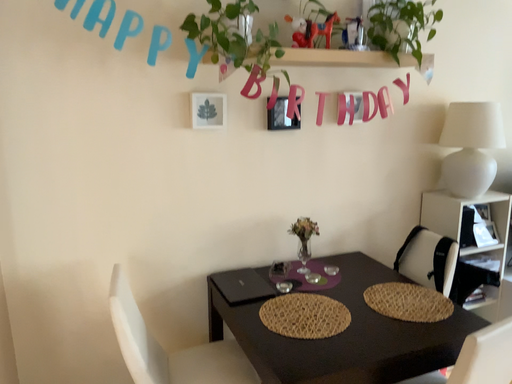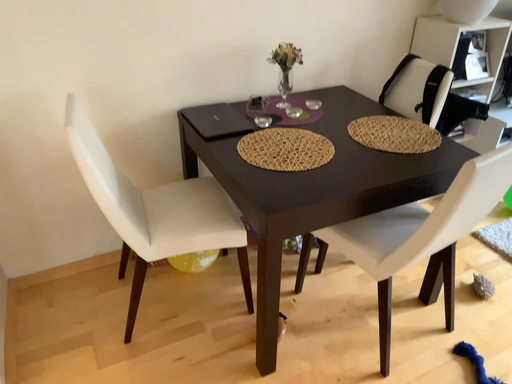
Question: How did the camera likely rotate when shooting the video?

Choices:
 (A) rotated upward
 (B) rotated downward

Answer: (B)